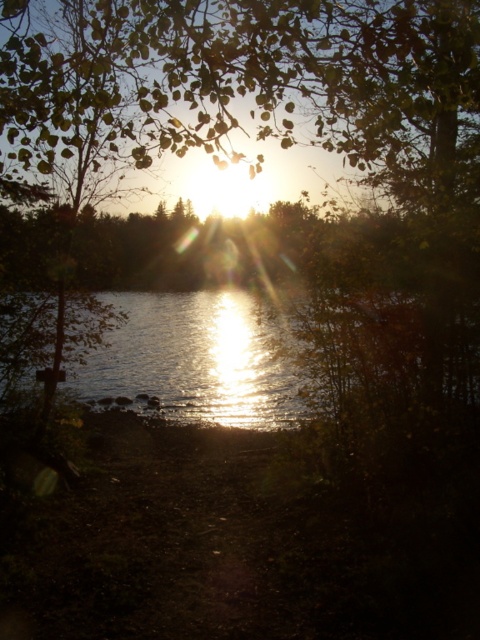
You are a photographer wanting to capture the reflection of the glistening reflective water at center in your shot. Considering the green leafy tree at upper center, will its height affect the reflection?

The green leafy tree at upper center is taller than the glistening reflective water at center, so its branches may block the sunlight needed for the reflection, potentially reducing its visibility in your photo.

You are standing on the dirt path and want to take a photo of the glistening reflective water at center without the green leafy tree at upper center blocking the view. Is this possible?

The green leafy tree at upper center is closer to the viewer than the glistening reflective water at center, so the tree will block the view of the water unless you move to a position where the tree is out of the frame.

You are standing on the dirt path leading to the water and want to take a photo of the glistening reflective water at center. To include the green leafy tree at upper center in your shot, should you move to your left or right?

You should move to your right to include the green leafy tree at upper center, which is to the left of the glistening reflective water at center in the image.